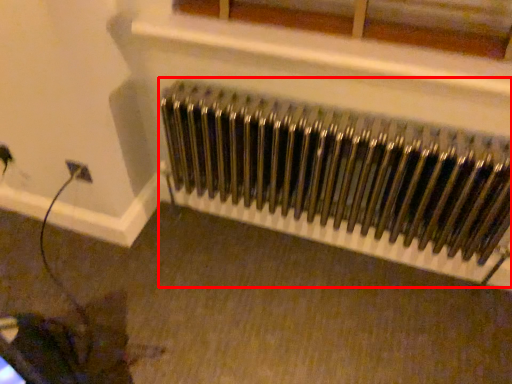
Question: Considering the relative positions of radiator (annotated by the red box) and window in the image provided, where is radiator (annotated by the red box) located with respect to the staircase?

Choices:
 (A) left
 (B) right

Answer: (B)